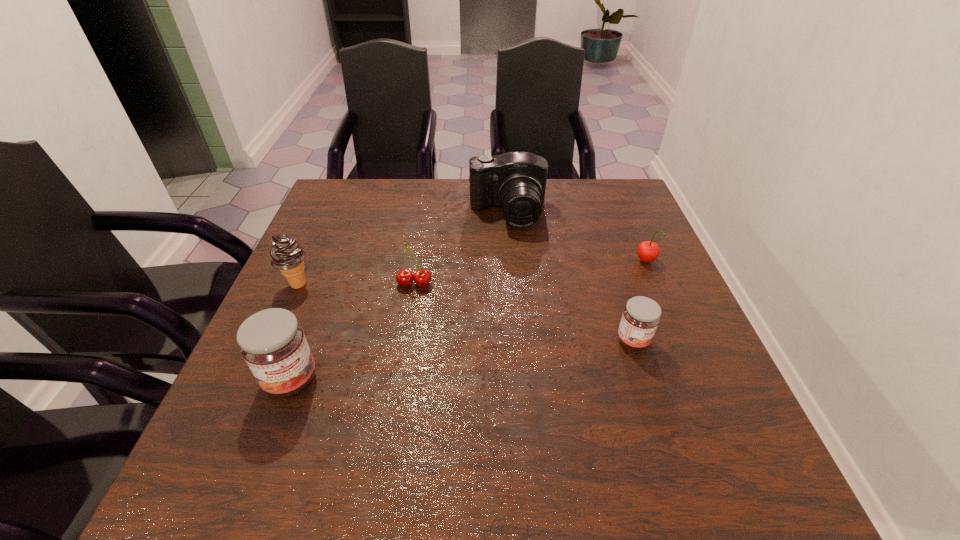
At what (x,y) coordinates should I click in order to perform the action: click on the right cherry. Please return your answer as a coordinate pair (x, y). The height and width of the screenshot is (540, 960). Looking at the image, I should click on (648, 251).

Where is `blank space located 0.240m on the right of the nearer jam`? The height and width of the screenshot is (540, 960). blank space located 0.240m on the right of the nearer jam is located at coordinates (443, 380).

Where is `vacant area situated on the left of the right jam`? This screenshot has height=540, width=960. vacant area situated on the left of the right jam is located at coordinates (501, 341).

Image resolution: width=960 pixels, height=540 pixels. I want to click on vacant space located 0.360m on the lens of the farthest object, so click(x=516, y=330).

You are a GUI agent. You are given a task and a screenshot of the screen. Output one action in this format:
    pyautogui.click(x=<x>, y=<y>)
    Task: Click on the vacant area situated with the stems of the fourth object from right to left pointing upwards
    
    Given the screenshot: What is the action you would take?
    pyautogui.click(x=407, y=329)

The height and width of the screenshot is (540, 960). In order to click on vacant space located on the right of the icecream in this screenshot , I will do `click(476, 284)`.

Where is `blank space located on the left of the right cherry`? blank space located on the left of the right cherry is located at coordinates (520, 262).

The width and height of the screenshot is (960, 540). Find the location of `object at the far edge`. object at the far edge is located at coordinates (515, 181).

Locate an element on the screen. object that is positioned at the near edge is located at coordinates (272, 342).

Locate an element on the screen. jam present at the left edge is located at coordinates (272, 342).